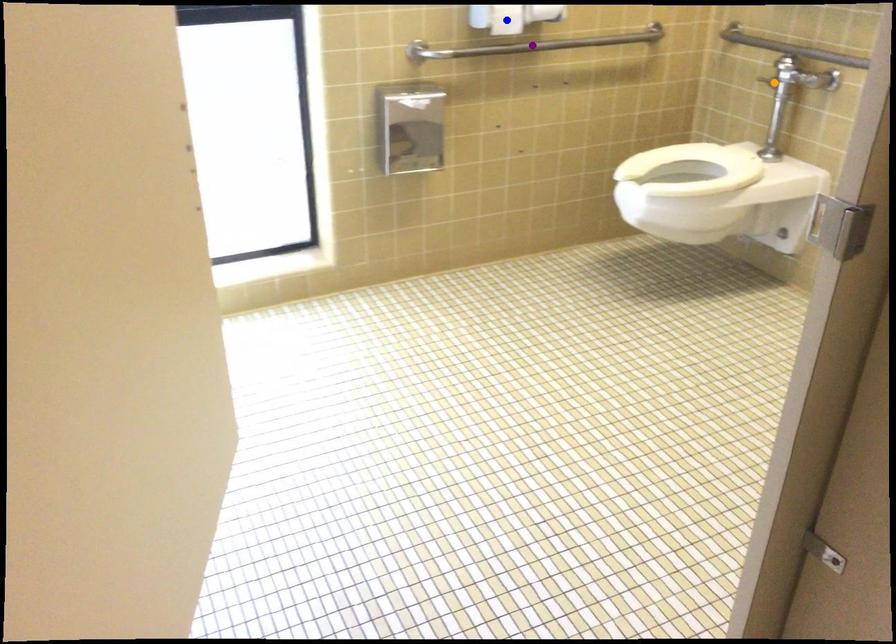
Order these from nearest to farthest:
1. orange point
2. blue point
3. purple point

blue point → orange point → purple point